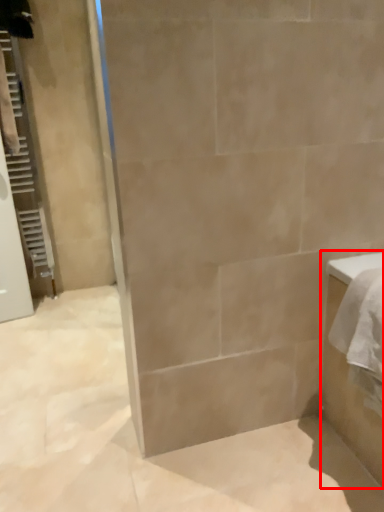
Question: From the image's perspective, what is the correct spatial relationship of bathroom cabinet (annotated by the red box) in relation to screen door?

Choices:
 (A) below
 (B) above

Answer: (A)